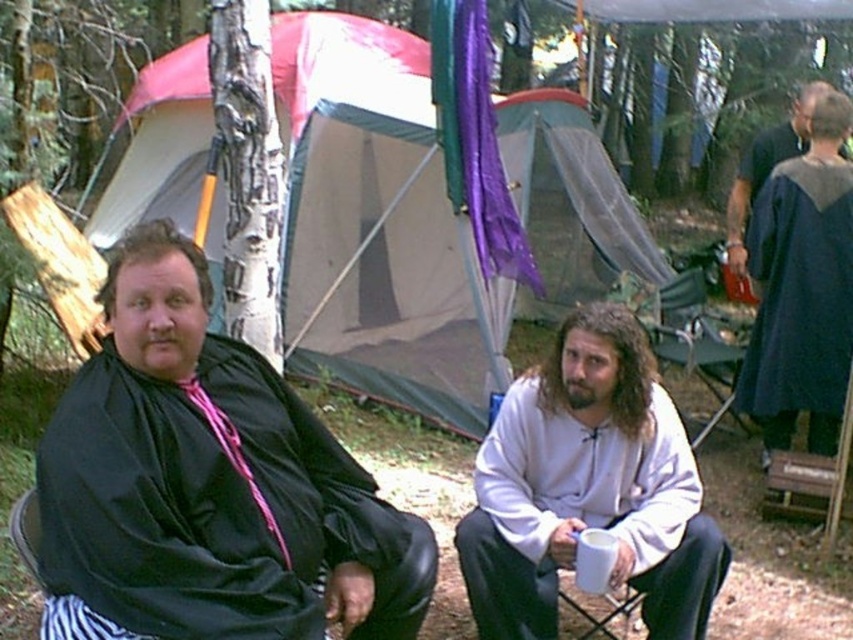
Question: Estimate the real-world distances between objects in this image. Which object is closer to the white matte sweatshirt at center?

Choices:
 (A) dark blue cape at upper right
 (B) metallic folding chair at center
 (C) dark blue fabric robe at right
 (D) black matte robe at left

Answer: (D)

Question: Is white matte sweatshirt at center to the right of dark blue fabric robe at right from the viewer's perspective?

Choices:
 (A) no
 (B) yes

Answer: (A)

Question: Is dark blue fabric robe at right to the right of dark blue cape at upper right from the viewer's perspective?

Choices:
 (A) no
 (B) yes

Answer: (A)

Question: Which of these objects is positioned closest to the dark blue cape at upper right?

Choices:
 (A) metallic folding chair at center
 (B) white matte sweatshirt at center
 (C) beige canvas tent at center
 (D) dark blue fabric robe at right

Answer: (A)

Question: Where is dark blue fabric robe at right located in relation to dark blue cape at upper right in the image?

Choices:
 (A) left
 (B) right

Answer: (A)

Question: Which point appears farthest from the camera in this image?

Choices:
 (A) (799, 147)
 (B) (267, 472)
 (C) (544, 451)
 (D) (840, 253)

Answer: (A)